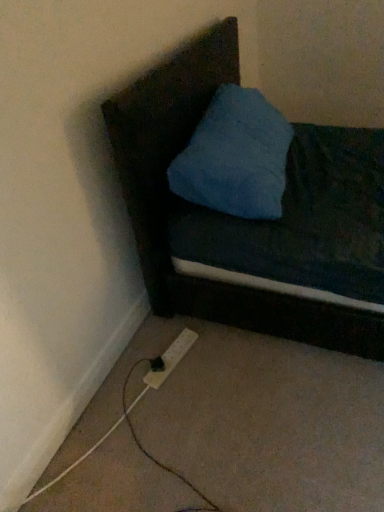
The height and width of the screenshot is (512, 384). I want to click on vacant region to the right of white plastic power plugs and sockets at lower left, so click(209, 353).